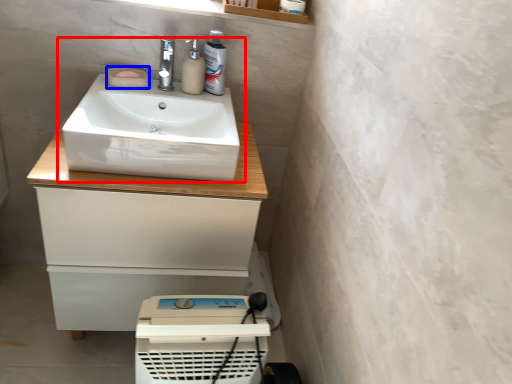
Question: Among these objects, which one is farthest to the camera, sink (highlighted by a red box) or soap (highlighted by a blue box)?

Choices:
 (A) sink
 (B) soap

Answer: (B)